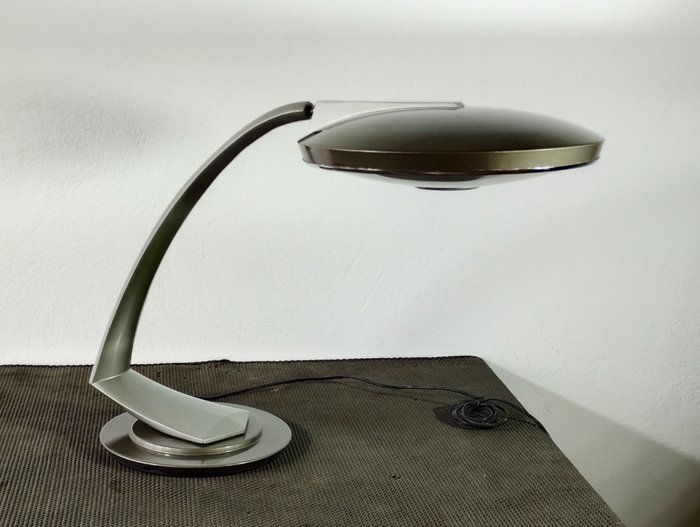
This screenshot has height=527, width=700. What are the coordinates of `cord` in the screenshot? It's located at (463, 414).